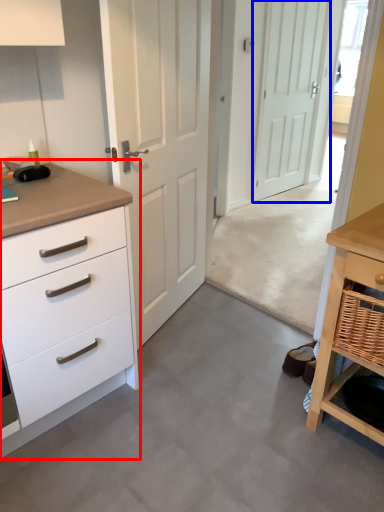
Question: Among these objects, which one is nearest to the camera, chest of drawers (highlighted by a red box) or door (highlighted by a blue box)?

Choices:
 (A) chest of drawers
 (B) door

Answer: (A)